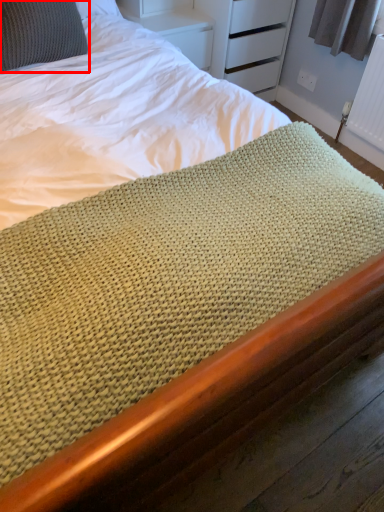
Question: In this image, where is pillow (annotated by the red box) located relative to radiator?

Choices:
 (A) right
 (B) left

Answer: (B)